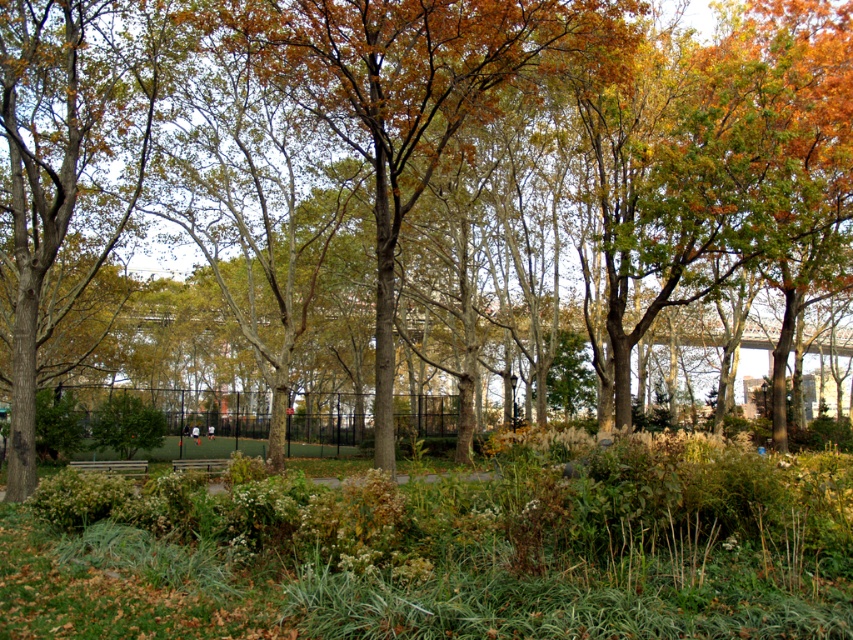
You are standing at the center of the park and want to find the brown rough tree at lower left. According to the coordinates provided, in which direction should you walk to reach it?

The brown rough tree at lower left is located at point coordinates lower left, so you should walk towards the lower left direction to reach it.

You are standing at the center of the park and see the point marked as point (x=65, y=168). What object is located at that point?

The point (x=65, y=168) corresponds to the brown rough tree at lower left.